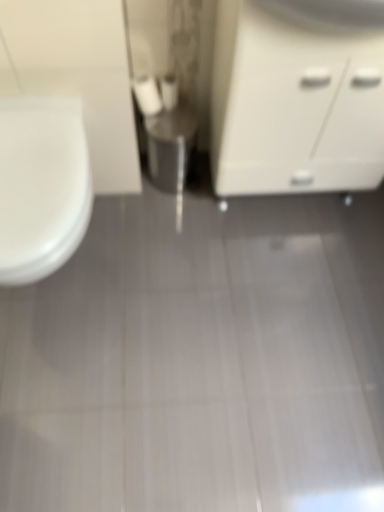
Question: Is white matte toilet paper at center, the first toilet paper viewed from the left, not inside white matte toilet paper at center, placed as the 1th toilet paper when sorted from right to left?

Choices:
 (A) no
 (B) yes

Answer: (B)

Question: Considering the relative sizes of white matte toilet paper at center, which is the second toilet paper in right-to-left order, and white matte toilet paper at center, placed as the 1th toilet paper when sorted from right to left, in the image provided, is white matte toilet paper at center, which is the second toilet paper in right-to-left order, wider than white matte toilet paper at center, placed as the 1th toilet paper when sorted from right to left,?

Choices:
 (A) yes
 (B) no

Answer: (A)

Question: Is white matte toilet paper at center, the first toilet paper viewed from the left, with white matte toilet paper at center, the 2th toilet paper in the left-to-right sequence?

Choices:
 (A) yes
 (B) no

Answer: (A)

Question: Considering the relative positions of white matte toilet paper at center, which is the second toilet paper in right-to-left order, and white matte toilet paper at center, placed as the 1th toilet paper when sorted from right to left, in the image provided, is white matte toilet paper at center, which is the second toilet paper in right-to-left order, to the right of white matte toilet paper at center, placed as the 1th toilet paper when sorted from right to left, from the viewer's perspective?

Choices:
 (A) no
 (B) yes

Answer: (A)

Question: Considering the relative sizes of white matte toilet paper at center, the first toilet paper viewed from the left, and white matte toilet paper at center, placed as the 1th toilet paper when sorted from right to left, in the image provided, is white matte toilet paper at center, the first toilet paper viewed from the left, shorter than white matte toilet paper at center, placed as the 1th toilet paper when sorted from right to left,?

Choices:
 (A) no
 (B) yes

Answer: (A)

Question: From the image's perspective, relative to white glossy toilet at left, is white matte toilet paper at center, the 2th toilet paper in the left-to-right sequence, above or below?

Choices:
 (A) above
 (B) below

Answer: (A)

Question: In terms of height, does white matte toilet paper at center, the 2th toilet paper in the left-to-right sequence, look taller or shorter compared to white glossy toilet at left?

Choices:
 (A) short
 (B) tall

Answer: (A)

Question: In terms of size, does white matte toilet paper at center, the 2th toilet paper in the left-to-right sequence, appear bigger or smaller than white glossy toilet at left?

Choices:
 (A) big
 (B) small

Answer: (B)

Question: Would you say white matte toilet paper at center, the 2th toilet paper in the left-to-right sequence, is inside or outside white glossy toilet at left?

Choices:
 (A) outside
 (B) inside

Answer: (A)

Question: From the image's perspective, relative to white matte cabinet at right, is white matte toilet paper at center, the first toilet paper viewed from the left, above or below?

Choices:
 (A) below
 (B) above

Answer: (B)

Question: From a real-world perspective, is white matte toilet paper at center, the first toilet paper viewed from the left, physically located above or below white matte cabinet at right?

Choices:
 (A) below
 (B) above

Answer: (A)

Question: Is white matte toilet paper at center, the first toilet paper viewed from the left, in front of or behind white matte cabinet at right in the image?

Choices:
 (A) front
 (B) behind

Answer: (B)

Question: Which is correct: white matte toilet paper at center, which is the second toilet paper in right-to-left order, is inside white matte cabinet at right, or outside of it?

Choices:
 (A) outside
 (B) inside

Answer: (A)

Question: Based on their positions, is white matte toilet paper at center, placed as the 1th toilet paper when sorted from right to left, located to the left or right of white matte cabinet at right?

Choices:
 (A) right
 (B) left

Answer: (B)

Question: Considering their positions, is white matte toilet paper at center, placed as the 1th toilet paper when sorted from right to left, located in front of or behind white matte cabinet at right?

Choices:
 (A) front
 (B) behind

Answer: (B)